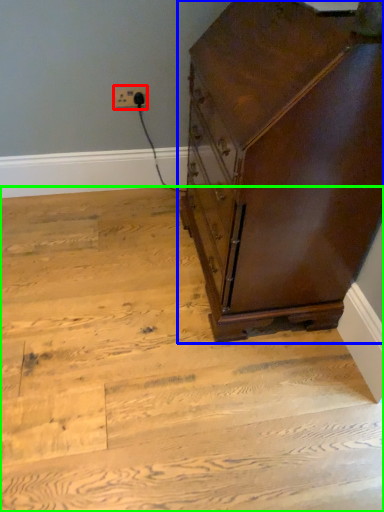
Question: Based on their relative distances, which object is nearer to electric outlet (highlighted by a red box)? Choose from chest of drawers (highlighted by a blue box) and stairwell (highlighted by a green box).

Choices:
 (A) chest of drawers
 (B) stairwell

Answer: (A)